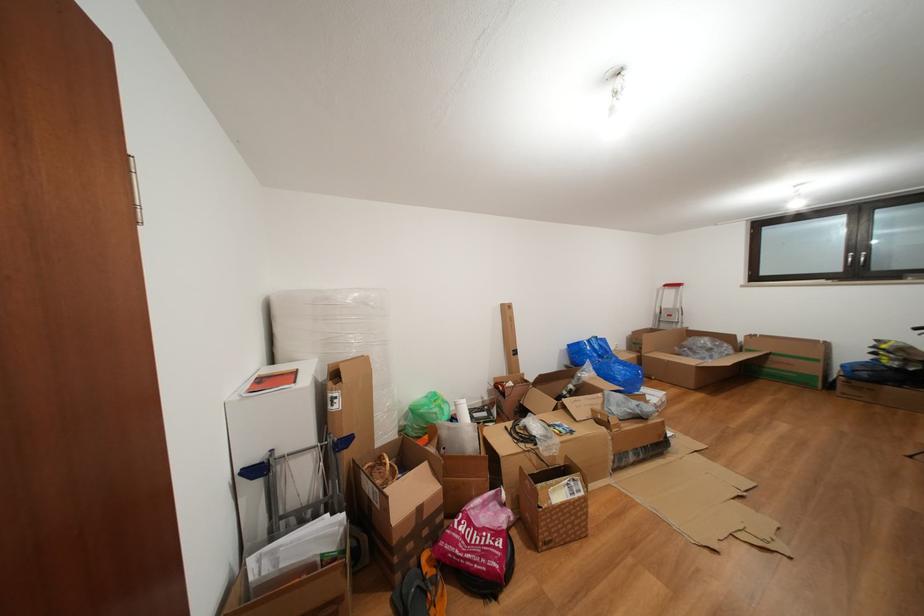
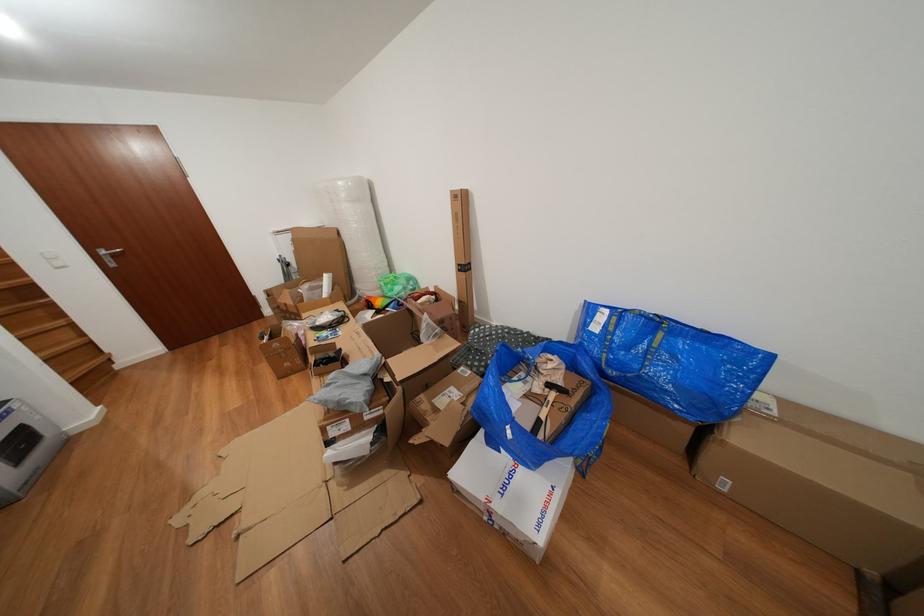
Where in the second image is the point corresponding to (x=521, y=360) from the first image?

(468, 276)